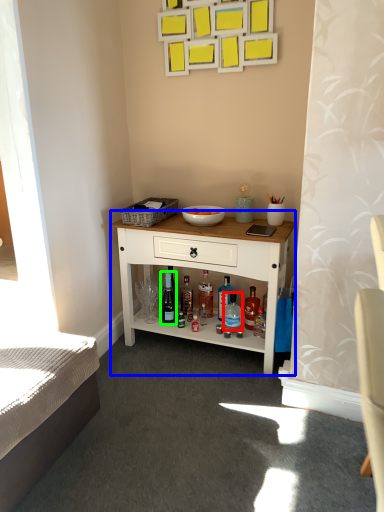
Question: Which is farther away from bottle (highlighted by a red box)? desk (highlighted by a blue box) or wine bottle (highlighted by a green box)?

Choices:
 (A) desk
 (B) wine bottle

Answer: (A)